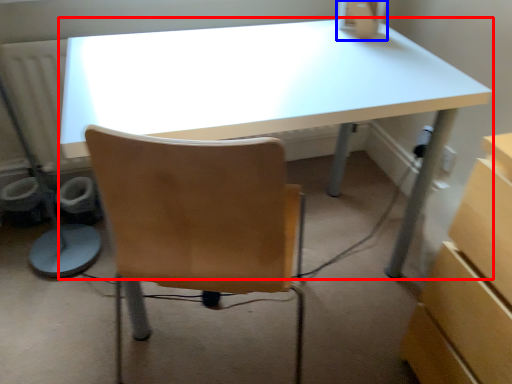
Question: Which of the following is the closest to the observer, desk (highlighted by a red box) or desktop computer (highlighted by a blue box)?

Choices:
 (A) desk
 (B) desktop computer

Answer: (A)